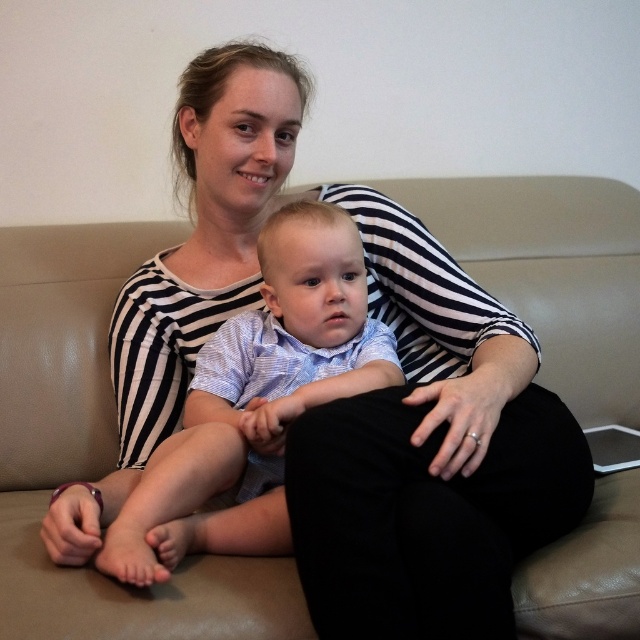
Does beige leather couch at center appear under light blue striped shirt at center?

No.

Can you confirm if beige leather couch at center is taller than light blue striped shirt at center?

Yes.

Between point (102, 426) and point (257, 330), which one is positioned in front?

Point (257, 330) is more forward.

This screenshot has height=640, width=640. What are the coordinates of `beige leather couch at center` in the screenshot? It's located at (93, 452).